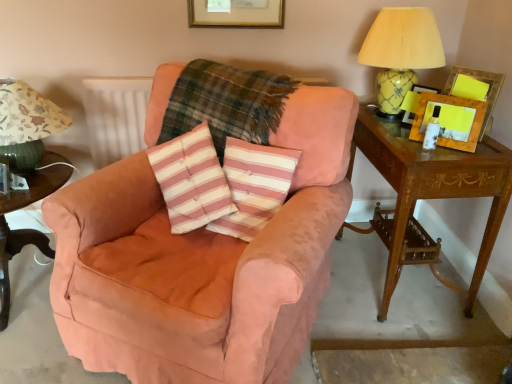
Locate an element on the screen. The height and width of the screenshot is (384, 512). wooden picture frame at right, which is the first picture frame from left to right is located at coordinates (450, 120).

What is the approximate width of green fabric lampshade at left, the second table lamp from the right?

The width of green fabric lampshade at left, the second table lamp from the right, is 45.32 centimeters.

This screenshot has width=512, height=384. I want to click on yellow glossy lampshade at upper right, the first table lamp in the right-to-left sequence, so click(x=401, y=52).

Find the location of a particular element. The width and height of the screenshot is (512, 384). dark green wood side table at lower left is located at coordinates (x=25, y=229).

Who is more distant, mahogany wood side table at right or plaid fabric at center?

Positioned behind is mahogany wood side table at right.

In the image, is mahogany wood side table at right on the left side or the right side of plaid fabric at center?

mahogany wood side table at right is to the right of plaid fabric at center.

How different are the orientations of mahogany wood side table at right and plaid fabric at center in degrees?

The angular difference between mahogany wood side table at right and plaid fabric at center is 58.8 degrees.

Can you confirm if wooden picture frame at upper right, the 1th picture frame positioned from the right, is taller than wooden picture frame at right, which is the first picture frame from left to right?

Yes.

Consider the image. Is wooden picture frame at upper right, marked as the 2th picture frame in a left-to-right arrangement, positioned before wooden picture frame at right, which is counted as the second picture frame, starting from the right?

No, it is behind wooden picture frame at right, which is counted as the second picture frame, starting from the right.

Is wooden picture frame at upper right, marked as the 2th picture frame in a left-to-right arrangement, smaller than wooden picture frame at right, which is the first picture frame from left to right?

No.

Who is bigger, plaid fabric at center or pink striped cushion at center?

plaid fabric at center.

Considering the sizes of objects plaid fabric at center and pink striped cushion at center in the image provided, who is shorter, plaid fabric at center or pink striped cushion at center?

With less height is pink striped cushion at center.

From the image's perspective, would you say plaid fabric at center is positioned over pink striped cushion at center?

Indeed, from the image's perspective, plaid fabric at center is shown above pink striped cushion at center.

Where is `pillow below the plaid fabric at center (from a real-world perspective)`? The height and width of the screenshot is (384, 512). pillow below the plaid fabric at center (from a real-world perspective) is located at coordinates (254, 186).

Is wooden picture frame at right, which is counted as the second picture frame, starting from the right, looking in the opposite direction of pink striped cushion at center?

That's not correct — wooden picture frame at right, which is counted as the second picture frame, starting from the right, is not looking away from pink striped cushion at center.

Can you see wooden picture frame at right, which is the first picture frame from left to right, touching pink striped cushion at center?

They are not placed beside each other.

Does wooden picture frame at right, which is the first picture frame from left to right, have a smaller size compared to pink striped cushion at center?

Indeed, wooden picture frame at right, which is the first picture frame from left to right, has a smaller size compared to pink striped cushion at center.

From the image's perspective, is suede pink armchair at center over green fabric lampshade at left, the second table lamp from the right?

Incorrect, from the image's perspective, suede pink armchair at center is lower than green fabric lampshade at left, the second table lamp from the right.

Which of these two, suede pink armchair at center or green fabric lampshade at left, the 1th table lamp from the left, stands taller?

Standing taller between the two is suede pink armchair at center.

Between point (202, 346) and point (14, 136), which one is positioned behind?

The point (14, 136) is more distant.

Looking at this image, is pink striped cushion at center in front of plaid fabric at center?

Yes, pink striped cushion at center is in front of plaid fabric at center.

Which of these two, pink striped cushion at center or plaid fabric at center, is thinner?

With smaller width is pink striped cushion at center.

Considering the relative sizes of pink striped cushion at center and plaid fabric at center in the image provided, is pink striped cushion at center taller than plaid fabric at center?

No, pink striped cushion at center is not taller than plaid fabric at center.

From the image's perspective, is pink striped cushion at center beneath plaid fabric at center?

Yes, from the image's perspective, pink striped cushion at center is beneath plaid fabric at center.

Is white textured radiator at upper left facing towards green fabric lampshade at left, the second table lamp from the right?

No, white textured radiator at upper left is not turned towards green fabric lampshade at left, the second table lamp from the right.

Which of these two, white textured radiator at upper left or green fabric lampshade at left, the second table lamp from the right, is bigger?

green fabric lampshade at left, the second table lamp from the right, is bigger.

Looking at this image, which object is positioned more to the left, white textured radiator at upper left or green fabric lampshade at left, the second table lamp from the right?

From the viewer's perspective, green fabric lampshade at left, the second table lamp from the right, appears more on the left side.

Can you confirm if white textured radiator at upper left is taller than green fabric lampshade at left, the 1th table lamp from the left?

Yes.

At what (x,y) coordinates should I click in order to perform the action: click on table located behind the plaid fabric at center. Please return your answer as a coordinate pair (x, y). The height and width of the screenshot is (384, 512). Looking at the image, I should click on (429, 196).

This screenshot has height=384, width=512. Identify the location of picture frame below the wooden picture frame at upper right, the 1th picture frame positioned from the right (from the image's perspective). (450, 120).

From the image, which object appears to be farther from dark green wood side table at lower left, green fabric lampshade at left, the second table lamp from the right, or suede pink armchair at center?

Among the two, suede pink armchair at center is located further to dark green wood side table at lower left.

Estimate the real-world distances between objects in this image. Which object is further from suede pink armchair at center, yellow glossy lampshade at upper right, the second table lamp when ordered from left to right, or mahogany wood side table at right?

yellow glossy lampshade at upper right, the second table lamp when ordered from left to right, is further to suede pink armchair at center.

Looking at the image, which one is located closer to pink striped cushion at center, suede pink armchair at center or wooden picture frame at right, which is counted as the second picture frame, starting from the right?

suede pink armchair at center lies closer to pink striped cushion at center than the other object.

Looking at the image, which one is located closer to green fabric lampshade at left, the 1th table lamp from the left, dark green wood side table at lower left or suede pink armchair at center?

Among the two, dark green wood side table at lower left is located nearer to green fabric lampshade at left, the 1th table lamp from the left.

From the image, which object appears to be nearer to yellow glossy lampshade at upper right, the first table lamp in the right-to-left sequence, dark green wood side table at lower left or pink striped cushion at center?

Among the two, pink striped cushion at center is located nearer to yellow glossy lampshade at upper right, the first table lamp in the right-to-left sequence.

From the image, which object appears to be farther from mahogany wood side table at right, green fabric lampshade at left, the 1th table lamp from the left, or dark green wood side table at lower left?

Based on the image, dark green wood side table at lower left appears to be further to mahogany wood side table at right.

Which object lies nearer to the anchor point green fabric lampshade at left, the 1th table lamp from the left, white textured radiator at upper left or dark green wood side table at lower left?

The object closer to green fabric lampshade at left, the 1th table lamp from the left, is white textured radiator at upper left.

Considering their positions, is white textured radiator at upper left positioned further to plaid fabric at center than green fabric lampshade at left, the 1th table lamp from the left?

The object further to plaid fabric at center is green fabric lampshade at left, the 1th table lamp from the left.

The height and width of the screenshot is (384, 512). Find the location of `nightstand between suede pink armchair at center and white textured radiator at upper left in the front-back direction`. nightstand between suede pink armchair at center and white textured radiator at upper left in the front-back direction is located at coordinates (25, 229).

The image size is (512, 384). What are the coordinates of `table between pink striped cushion at center and wooden picture frame at upper right, the 1th picture frame positioned from the right` in the screenshot? It's located at (429, 196).

At what (x,y) coordinates should I click in order to perform the action: click on table lamp situated between dark green wood side table at lower left and plaid fabric at center from left to right. Please return your answer as a coordinate pair (x, y). Looking at the image, I should click on (26, 124).

Where is `plaid situated between white textured radiator at upper left and wooden picture frame at upper right, the 1th picture frame positioned from the right, from left to right`? The height and width of the screenshot is (384, 512). plaid situated between white textured radiator at upper left and wooden picture frame at upper right, the 1th picture frame positioned from the right, from left to right is located at coordinates (226, 103).